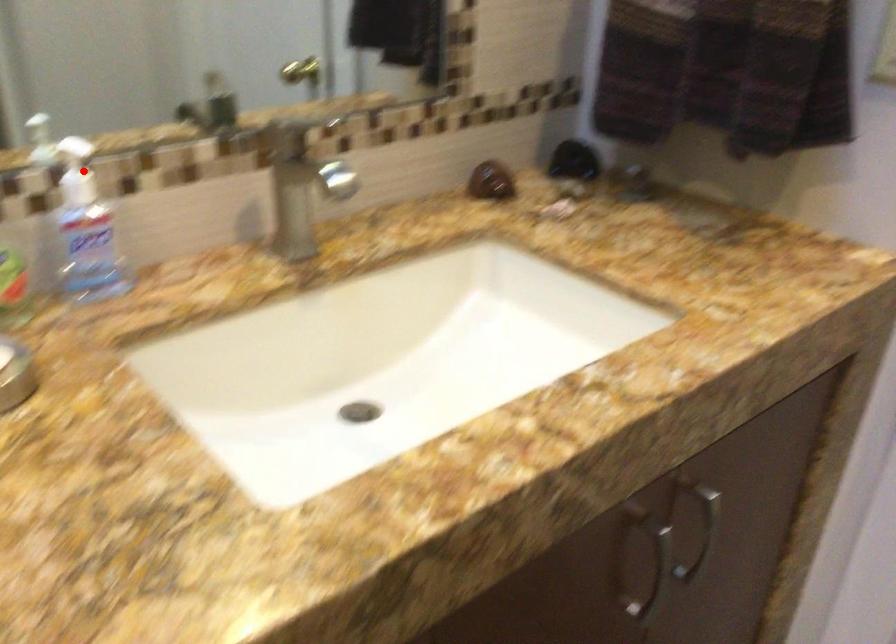
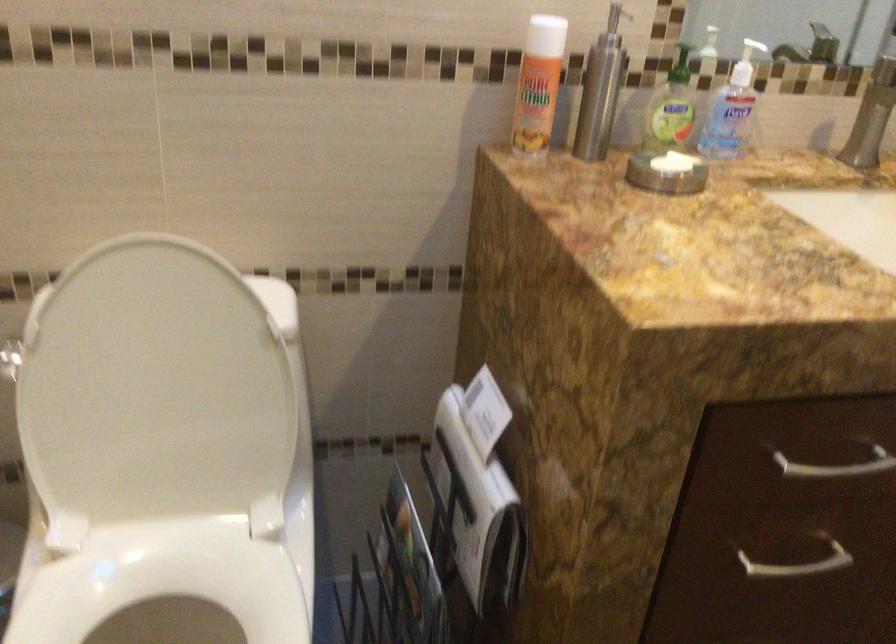
Question: I am providing you with two images of the same scene from different viewpoints. Given a red point in image1, look at the same physical point in image2. Is it:

Choices:
 (A) Closer to the viewpoint
 (B) Farther from the viewpoint

Answer: (B)